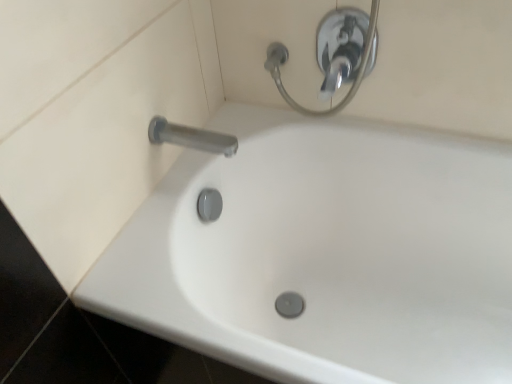
Question: Could white glossy bathtub at center be considered to be inside chrome metallic shower handle at upper center?

Choices:
 (A) no
 (B) yes

Answer: (A)

Question: From a real-world perspective, is chrome metallic shower handle at upper center positioned over white glossy bathtub at center based on gravity?

Choices:
 (A) yes
 (B) no

Answer: (A)

Question: Is chrome metallic shower handle at upper center not inside white glossy bathtub at center?

Choices:
 (A) no
 (B) yes

Answer: (B)

Question: Is chrome metallic shower handle at upper center positioned behind white glossy bathtub at center?

Choices:
 (A) no
 (B) yes

Answer: (B)

Question: From the image's perspective, would you say chrome metallic shower handle at upper center is positioned over white glossy bathtub at center?

Choices:
 (A) yes
 (B) no

Answer: (A)

Question: From their relative heights in the image, would you say chrome metallic shower handle at upper center is taller or shorter than white glossy bathtub at center?

Choices:
 (A) tall
 (B) short

Answer: (B)

Question: Do you think chrome metallic shower handle at upper center is within white glossy bathtub at center, or outside of it?

Choices:
 (A) outside
 (B) inside

Answer: (A)

Question: Relative to white glossy bathtub at center, is chrome metallic shower handle at upper center in front or behind?

Choices:
 (A) front
 (B) behind

Answer: (B)

Question: From a real-world perspective, relative to white glossy bathtub at center, is chrome metallic shower handle at upper center vertically above or below?

Choices:
 (A) above
 (B) below

Answer: (A)

Question: From a real-world perspective, relative to satin nickel faucet at upper left, is white glossy bathtub at center vertically above or below?

Choices:
 (A) above
 (B) below

Answer: (B)

Question: Is white glossy bathtub at center wider or thinner than satin nickel faucet at upper left?

Choices:
 (A) thin
 (B) wide

Answer: (B)

Question: Considering their positions, is white glossy bathtub at center located in front of or behind satin nickel faucet at upper left?

Choices:
 (A) behind
 (B) front

Answer: (B)

Question: Considering the positions of white glossy bathtub at center and satin nickel faucet at upper left in the image, is white glossy bathtub at center taller or shorter than satin nickel faucet at upper left?

Choices:
 (A) tall
 (B) short

Answer: (A)

Question: From the image's perspective, relative to satin nickel faucet at upper left, is chrome metallic shower handle at upper center above or below?

Choices:
 (A) below
 (B) above

Answer: (B)

Question: Visually, is chrome metallic shower handle at upper center positioned to the left or to the right of satin nickel faucet at upper left?

Choices:
 (A) left
 (B) right

Answer: (B)